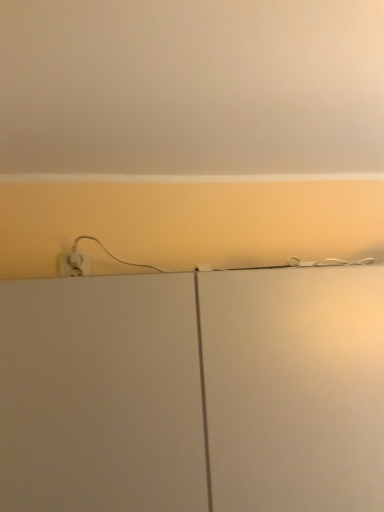
Question: In terms of width, does matte white wall at upper center look wider or thinner when compared to white matte cabinet at center?

Choices:
 (A) thin
 (B) wide

Answer: (B)

Question: Is matte white wall at upper center to the left or to the right of white matte cabinet at center in the image?

Choices:
 (A) right
 (B) left

Answer: (A)

Question: Choose the correct answer: Is matte white wall at upper center inside white matte cabinet at center or outside it?

Choices:
 (A) inside
 (B) outside

Answer: (B)

Question: Is point (231, 416) closer or farther from the camera than point (314, 165)?

Choices:
 (A) farther
 (B) closer

Answer: (B)

Question: From a real-world perspective, is white matte cabinet at center physically located above or below matte white wall at upper center?

Choices:
 (A) above
 (B) below

Answer: (B)

Question: Choose the correct answer: Is white matte cabinet at center inside matte white wall at upper center or outside it?

Choices:
 (A) outside
 (B) inside

Answer: (A)

Question: From the image's perspective, is white matte cabinet at center above or below matte white wall at upper center?

Choices:
 (A) above
 (B) below

Answer: (B)